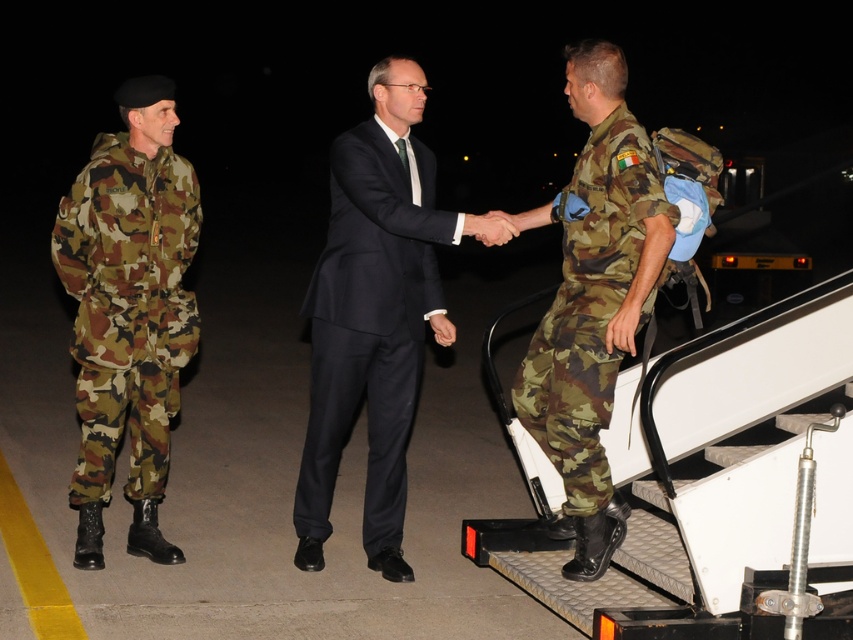
You are a security guard at the airport. You see the dark blue suit at center and the soldier on the mobile staircase. How far apart are they?

The dark blue suit at center and the soldier on the mobile staircase are 3.82 meters apart.

You are a photographer at the airport tarmac during nighttime. You need to capture a photo where both the camo fabric uniform at left and the camo fabric uniform at right are visible. Given their height difference, will the taller one block the shorter one from the camera view?

The camo fabric uniform at left is much taller than the camo fabric uniform at right. Since the taller one is at the left, it might block part of the shorter one if they are aligned in the same line of sight. Adjust the camera angle to ensure both are visible.

You are a photographer positioned at the back of the scene. You need to take a photo of the dark blue suit at center and the camo fabric uniform at right. Which object will appear larger in your photo?

The dark blue suit at center will appear larger in the photo because it is closer to the photographer than the camo fabric uniform at right.